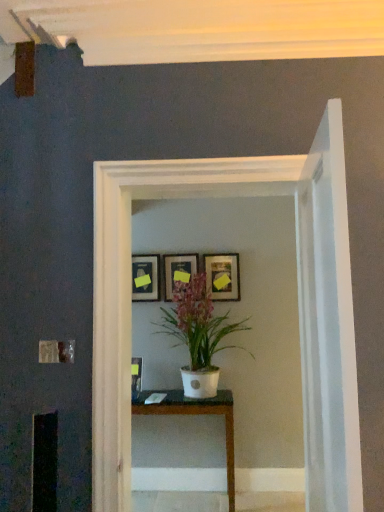
Question: Is white glossy table at center inside or outside of white matte pot at center?

Choices:
 (A) outside
 (B) inside

Answer: (A)

Question: Is white glossy table at center to the left or to the right of white matte pot at center in the image?

Choices:
 (A) left
 (B) right

Answer: (A)

Question: Which of these objects is positioned farthest from the white matte pot at center?

Choices:
 (A) white glossy table at center
 (B) matte black picture frame at upper center, the 3th picture frame positioned from the right
 (C) matte black picture frame at center, the third picture frame viewed from the left
 (D) matte wooden picture frame at center, which is the 2th picture frame from left to right
 (E) white glossy glass door at center

Answer: (E)

Question: Which object is the closest to the white matte pot at center?

Choices:
 (A) matte black picture frame at upper center, the 3th picture frame positioned from the right
 (B) white glossy glass door at center
 (C) white glossy table at center
 (D) matte black picture frame at center, the first picture frame from the right
 (E) matte wooden picture frame at center, which is the second picture frame from right to left

Answer: (D)